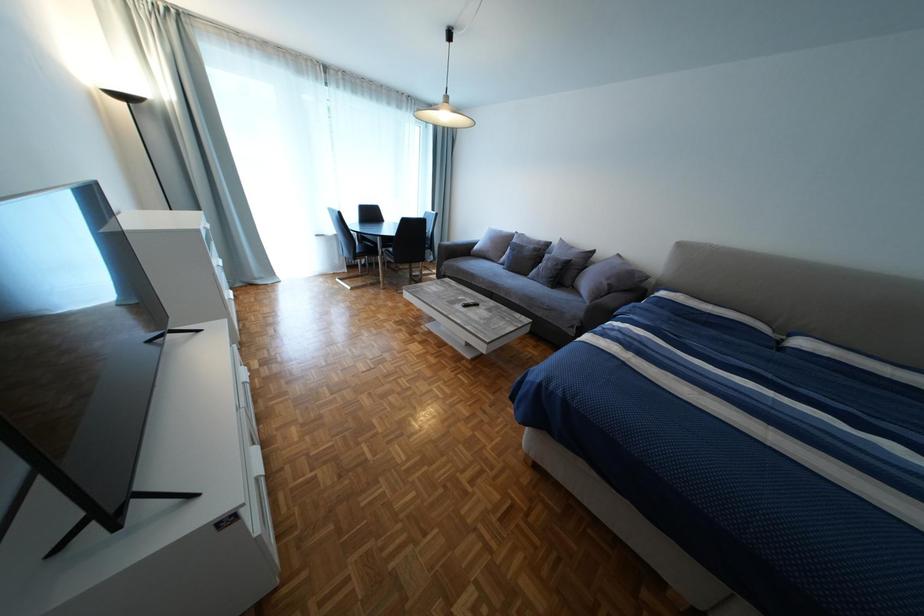
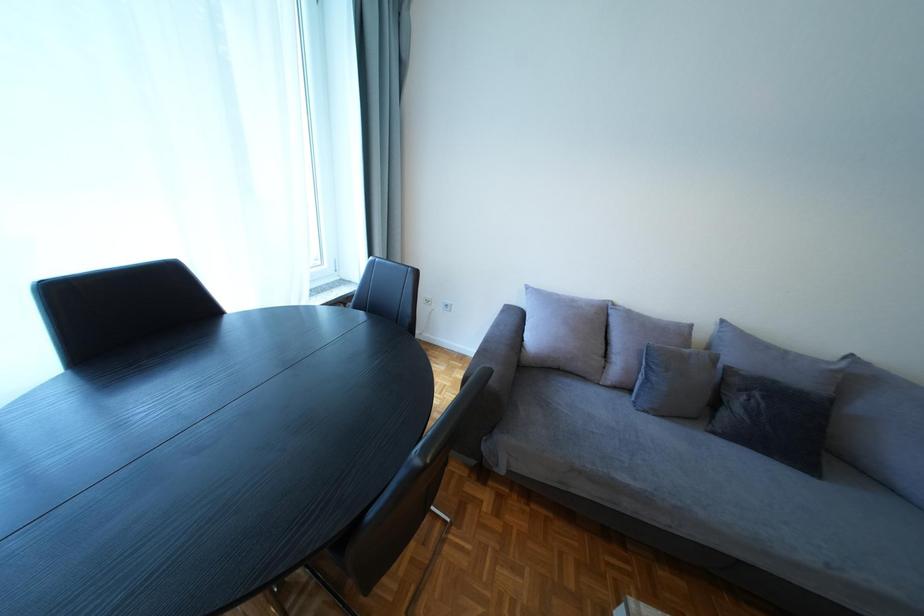
Question: What movement of the cameraman would produce the second image?

Choices:
 (A) Left
 (B) Right
 (C) Forward
 (D) Backward

Answer: (C)